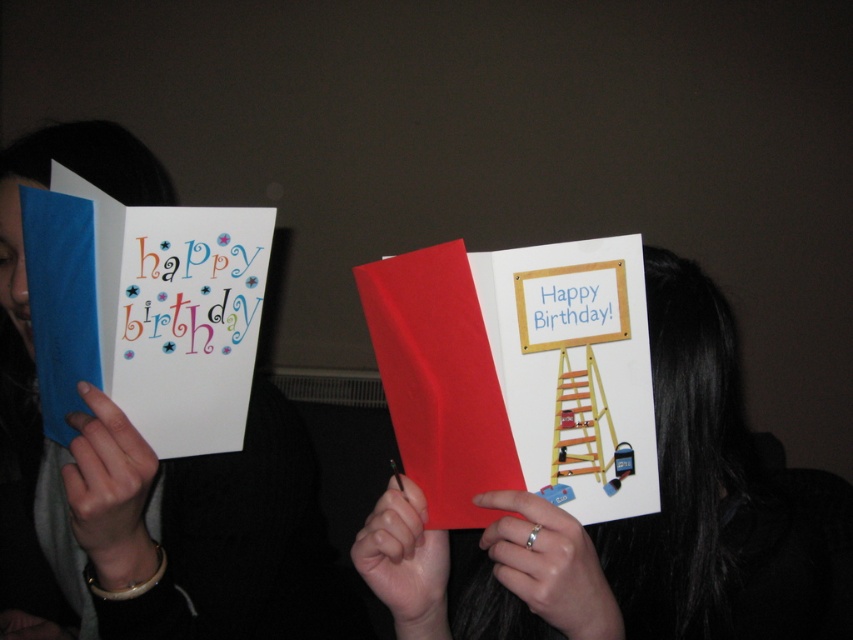
Which is behind, point (514, 593) or point (572, 458)?

The point (572, 458) is behind.

This screenshot has width=853, height=640. I want to click on white paper card at center, so click(639, 522).

What do you see at coordinates (639, 522) in the screenshot?
I see `white paper card at center` at bounding box center [639, 522].

At what (x,y) coordinates should I click in order to perform the action: click on white paper card at center. Please return your answer as a coordinate pair (x, y). The width and height of the screenshot is (853, 640). Looking at the image, I should click on (639, 522).

Is matte white greeting card at center bigger than matte white greeting card at left?

Actually, matte white greeting card at center might be smaller than matte white greeting card at left.

Between point (428, 266) and point (219, 248), which one is positioned in front?

Positioned in front is point (428, 266).

Does point (462, 490) come in front of point (71, 275)?

That is True.

The height and width of the screenshot is (640, 853). I want to click on matte white greeting card at center, so click(515, 372).

Does matte white greeting card at center have a larger size compared to wooden ladder at center?

Yes.

Is matte white greeting card at center positioned behind wooden ladder at center?

No, matte white greeting card at center is in front of wooden ladder at center.

The height and width of the screenshot is (640, 853). In order to click on matte white greeting card at center in this screenshot , I will do `click(515, 372)`.